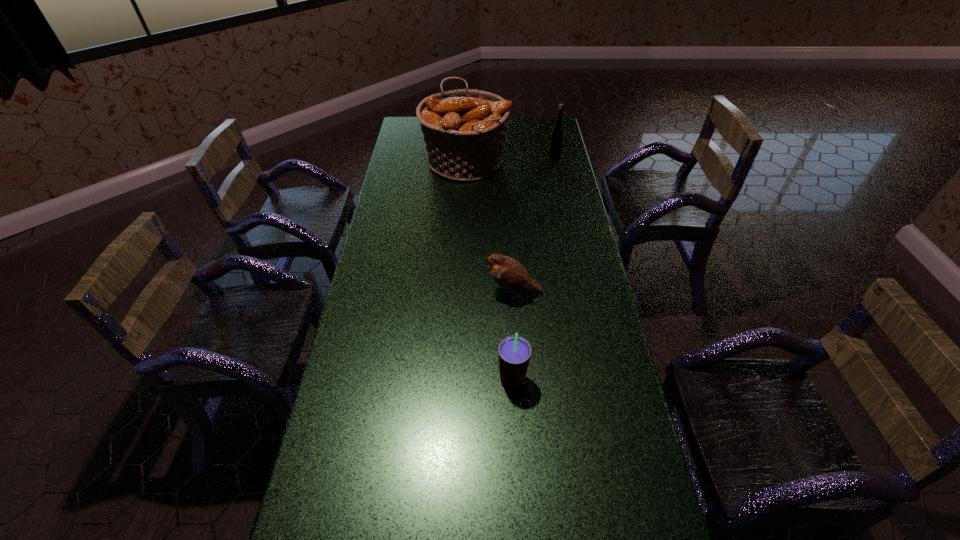
Identify the location of vacant region between the basket and the shortest object. Image resolution: width=960 pixels, height=540 pixels. (489, 226).

At what (x,y) coordinates should I click in order to perform the action: click on empty location between the beer bottle and the bird. Please return your answer as a coordinate pair (x, y). This screenshot has width=960, height=540. Looking at the image, I should click on (534, 225).

Locate which object ranks second in proximity to the smoothie. Please provide its 2D coordinates. Your answer should be formatted as a tuple, i.e. [(x, y)], where the tuple contains the x and y coordinates of a point satisfying the conditions above.

[(464, 130)]

Find the location of `object identified as the third closest to the basket`. object identified as the third closest to the basket is located at coordinates (514, 351).

This screenshot has width=960, height=540. In order to click on vacant region that satisfies the following two spatial constraints: 1. on the front side of the tallest object; 2. on the right side of the third tallest object in this screenshot , I will do `click(456, 379)`.

The width and height of the screenshot is (960, 540). What are the coordinates of `blank space that satisfies the following two spatial constraints: 1. on the front side of the second tallest object; 2. at the face of the shortest object` in the screenshot? It's located at (584, 292).

You are a GUI agent. You are given a task and a screenshot of the screen. Output one action in this format:
    pyautogui.click(x=<x>, y=<y>)
    Task: Click on the blank space that satisfies the following two spatial constraints: 1. on the back side of the rightmost object; 2. on the right side of the second shortest object
    This screenshot has width=960, height=540.
    Given the screenshot: What is the action you would take?
    point(499,158)

At what (x,y) coordinates should I click in order to perform the action: click on free spot that satisfies the following two spatial constraints: 1. on the back side of the basket; 2. on the right side of the beer bottle. Please return your answer as a coordinate pair (x, y). The image size is (960, 540). Looking at the image, I should click on (466, 158).